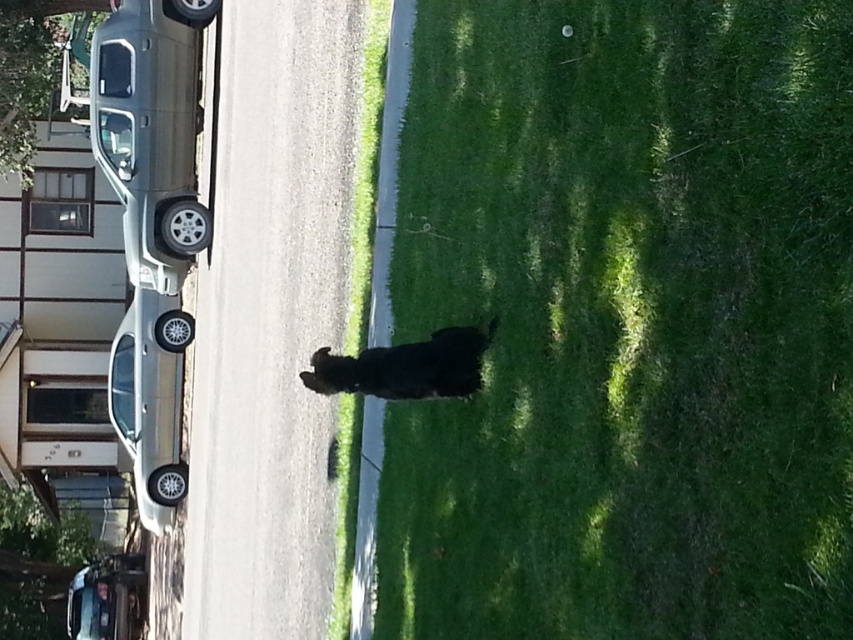
Is satin silver sedan at upper left to the right of silver metallic car at left from the viewer's perspective?

Correct, you'll find satin silver sedan at upper left to the right of silver metallic car at left.

Does satin silver sedan at upper left appear over silver metallic car at left?

Yes, satin silver sedan at upper left is above silver metallic car at left.

Does point (115, 100) come closer to viewer compared to point (160, 467)?

Yes, point (115, 100) is in front of point (160, 467).

You are a GUI agent. You are given a task and a screenshot of the screen. Output one action in this format:
    pyautogui.click(x=<x>, y=<y>)
    Task: Click on the satin silver sedan at upper left
    
    Given the screenshot: What is the action you would take?
    pyautogui.click(x=151, y=131)

Looking at this image, can you confirm if silver metallic car at left is smaller than metallic silver sedan at lower left?

Incorrect, silver metallic car at left is not smaller in size than metallic silver sedan at lower left.

Can you confirm if silver metallic car at left is taller than metallic silver sedan at lower left?

Indeed, silver metallic car at left has a greater height compared to metallic silver sedan at lower left.

Who is more distant from viewer, (169, 413) or (115, 609)?

The point (115, 609) is more distant.

In order to click on silver metallic car at left in this screenshot , I will do `click(151, 401)`.

How far apart are satin silver sedan at upper left and metallic silver sedan at lower left?

They are 10.12 meters apart.

This screenshot has width=853, height=640. What are the coordinates of `satin silver sedan at upper left` in the screenshot? It's located at (151, 131).